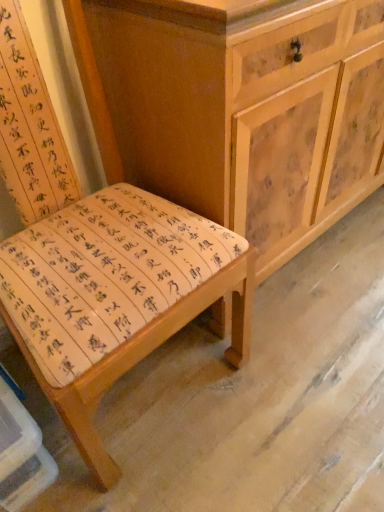
Question: Is wooden bench at center situated inside wooden cabinet at center or outside?

Choices:
 (A) inside
 (B) outside

Answer: (B)

Question: Is wooden bench at center to the left or to the right of wooden cabinet at center in the image?

Choices:
 (A) right
 (B) left

Answer: (B)

Question: In terms of height, does wooden bench at center look taller or shorter compared to wooden cabinet at center?

Choices:
 (A) short
 (B) tall

Answer: (B)

Question: Looking at the image, does wooden cabinet at center seem bigger or smaller compared to wooden bench at center?

Choices:
 (A) small
 (B) big

Answer: (B)

Question: Which is correct: wooden cabinet at center is inside wooden bench at center, or outside of it?

Choices:
 (A) outside
 (B) inside

Answer: (A)

Question: Visually, is wooden cabinet at center positioned to the left or to the right of wooden bench at center?

Choices:
 (A) right
 (B) left

Answer: (A)

Question: Is wooden cabinet at center wider or thinner than wooden bench at center?

Choices:
 (A) wide
 (B) thin

Answer: (B)